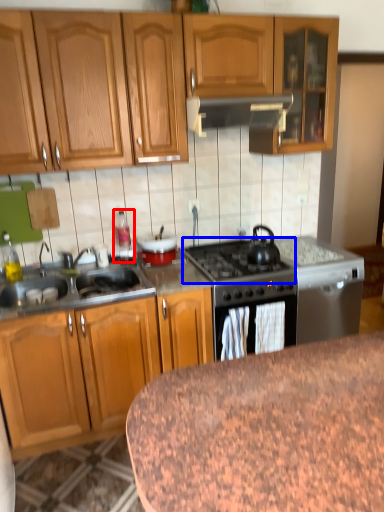
Question: Which of the following is the farthest to the observer, appliance (highlighted by a red box) or gas stove (highlighted by a blue box)?

Choices:
 (A) appliance
 (B) gas stove

Answer: (A)